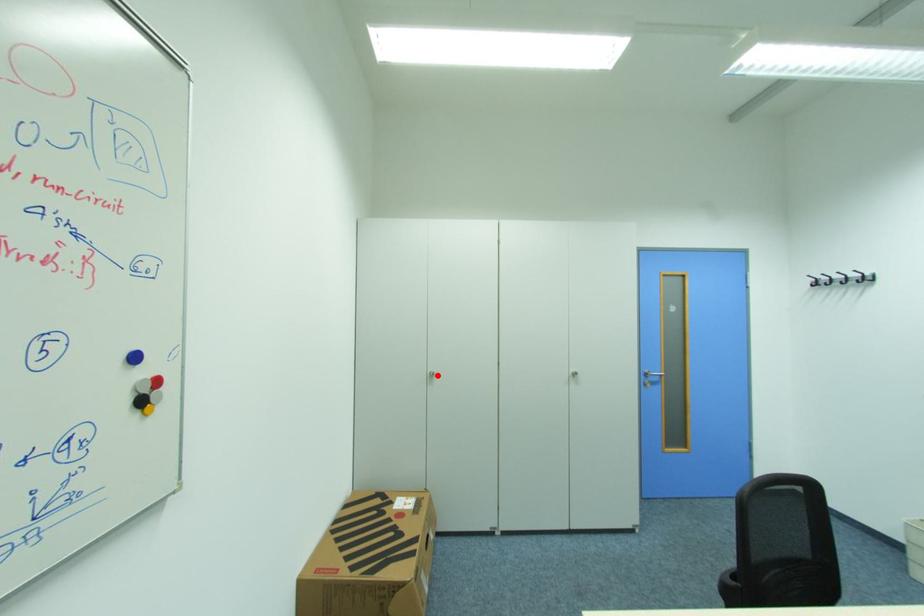
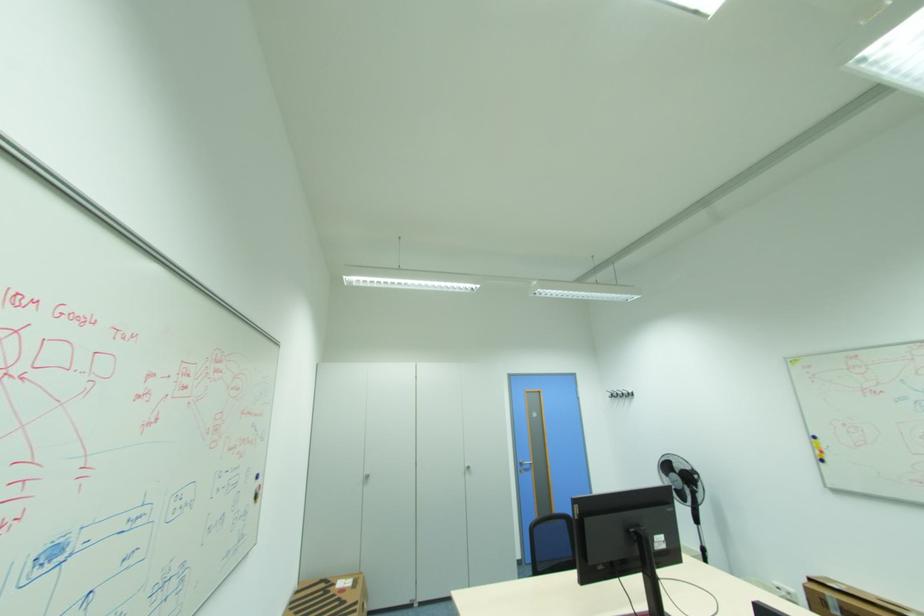
The point at the highlighted location is marked in the first image. Where is the corresponding point in the second image?

(372, 477)